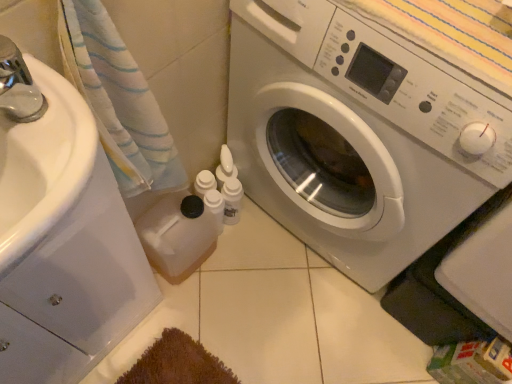
Question: Is white plastic bottles at center, the 2th toiletry when ordered from right to left, outside of white glossy drawer at left?

Choices:
 (A) yes
 (B) no

Answer: (A)

Question: Is white plastic bottles at center, the 2th toiletry when ordered from right to left, positioned before white glossy drawer at left?

Choices:
 (A) yes
 (B) no

Answer: (B)

Question: Is white plastic bottles at center, the 2th toiletry when ordered from right to left, thinner than white glossy drawer at left?

Choices:
 (A) no
 (B) yes

Answer: (B)

Question: From a real-world perspective, is white plastic bottles at center, marked as the 1th toiletry in a left-to-right arrangement, beneath white glossy drawer at left?

Choices:
 (A) no
 (B) yes

Answer: (B)

Question: From the image's perspective, is white plastic bottles at center, marked as the 1th toiletry in a left-to-right arrangement, on top of white glossy drawer at left?

Choices:
 (A) yes
 (B) no

Answer: (A)

Question: Is white plastic bottles at center, the 2th toiletry when ordered from right to left, oriented away from white glossy drawer at left?

Choices:
 (A) yes
 (B) no

Answer: (B)

Question: Can you confirm if white glossy drawer at left is positioned to the right of white plastic bottles at center, marked as the 1th toiletry in a left-to-right arrangement?

Choices:
 (A) no
 (B) yes

Answer: (A)

Question: Can you confirm if white glossy drawer at left is positioned to the left of white plastic bottles at center, marked as the 1th toiletry in a left-to-right arrangement?

Choices:
 (A) no
 (B) yes

Answer: (B)

Question: Is white glossy drawer at left wider than white plastic bottles at center, marked as the 1th toiletry in a left-to-right arrangement?

Choices:
 (A) no
 (B) yes

Answer: (B)

Question: Is white glossy drawer at left not within white plastic bottles at center, marked as the 1th toiletry in a left-to-right arrangement?

Choices:
 (A) no
 (B) yes

Answer: (B)

Question: Is the depth of white glossy drawer at left greater than that of white plastic bottles at center, marked as the 1th toiletry in a left-to-right arrangement?

Choices:
 (A) yes
 (B) no

Answer: (B)

Question: From a real-world perspective, is white glossy drawer at left located higher than white plastic bottles at center, the 2th toiletry when ordered from right to left?

Choices:
 (A) yes
 (B) no

Answer: (A)

Question: From a real-world perspective, is white fabric towel at left under white glossy washing machine at center?

Choices:
 (A) yes
 (B) no

Answer: (B)